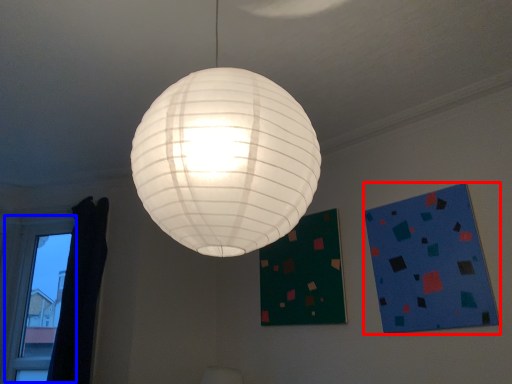
Question: Which object appears farthest to the camera in this image, design (highlighted by a red box) or window (highlighted by a blue box)?

Choices:
 (A) design
 (B) window

Answer: (B)